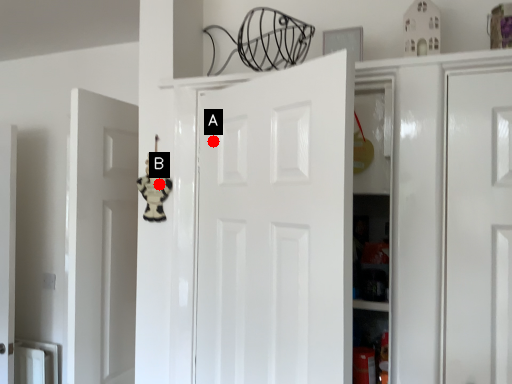
Question: Two points are circled on the image, labeled by A and B beside each circle. Which point appears closest to the camera in this image?

Choices:
 (A) A is closer
 (B) B is closer

Answer: (A)